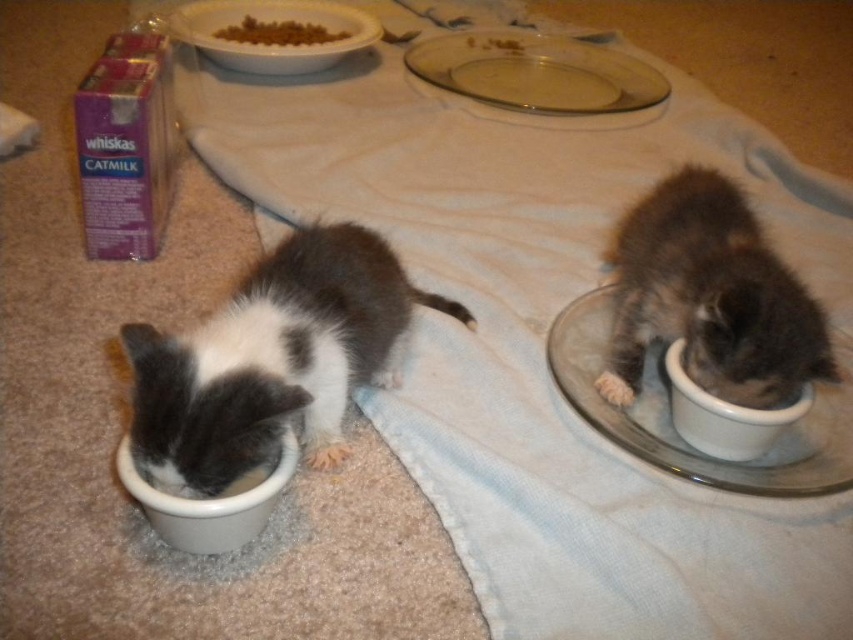
Does white glossy bowl at right have a lesser width compared to brown crumbly food at upper center?

Indeed, white glossy bowl at right has a lesser width compared to brown crumbly food at upper center.

Does white glossy bowl at right have a smaller size compared to brown crumbly food at upper center?

Yes, white glossy bowl at right is smaller than brown crumbly food at upper center.

Which is behind, point (769, 436) or point (248, 28)?

The point (248, 28) is behind.

Find the location of a particular element. white glossy bowl at right is located at coordinates (724, 416).

Can you confirm if white matte bowl at lower left is positioned to the left of brown crumbly food at upper center?

No, white matte bowl at lower left is not to the left of brown crumbly food at upper center.

Is white matte bowl at lower left further to the viewer compared to brown crumbly food at upper center?

No, white matte bowl at lower left is in front of brown crumbly food at upper center.

At what (x,y) coordinates should I click in order to perform the action: click on white matte bowl at lower left. Please return your answer as a coordinate pair (x, y). Looking at the image, I should click on (212, 502).

Between gray fur kitten at right and clear glass plate at upper center, which one appears on the left side from the viewer's perspective?

Positioned to the left is clear glass plate at upper center.

Find the location of a particular element. This screenshot has height=640, width=853. gray fur kitten at right is located at coordinates (711, 298).

Does point (682, 330) come behind point (590, 81)?

No, (682, 330) is closer to viewer.

Where is `gray fur kitten at right`? The width and height of the screenshot is (853, 640). gray fur kitten at right is located at coordinates (711, 298).